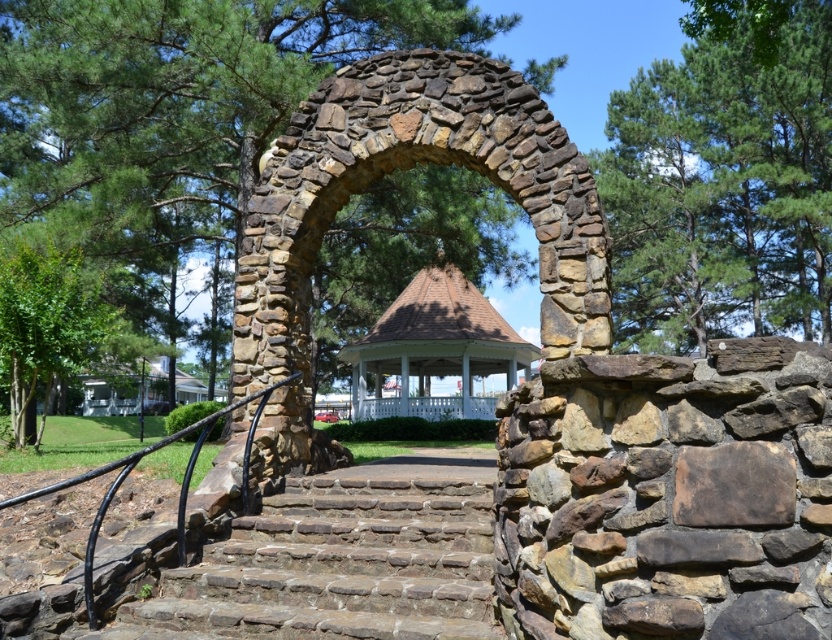
Question: Estimate the real-world distances between objects in this image. Which object is closer to the green leafy tree at center?

Choices:
 (A) black metal/rail at center
 (B) green leafy tree at left
 (C) brown stone arch at center

Answer: (B)

Question: Is green leafy tree at upper right wider than white wooden gazebo at center?

Choices:
 (A) yes
 (B) no

Answer: (A)

Question: Which point is closer to the camera?

Choices:
 (A) green leafy tree at left
 (B) black metal/rail at center

Answer: (B)

Question: Does green leafy tree at upper right have a lesser width compared to green leafy tree at left?

Choices:
 (A) yes
 (B) no

Answer: (B)

Question: Estimate the real-world distances between objects in this image. Which object is farther from the white wooden gazebo at center?

Choices:
 (A) brown stone stairs at center
 (B) brown stone arch at center
 (C) green leafy tree at upper right
 (D) green leafy tree at center

Answer: (A)

Question: Considering the relative positions of green leafy tree at center and green leafy tree at upper right in the image provided, where is green leafy tree at center located with respect to green leafy tree at upper right?

Choices:
 (A) right
 (B) left

Answer: (B)